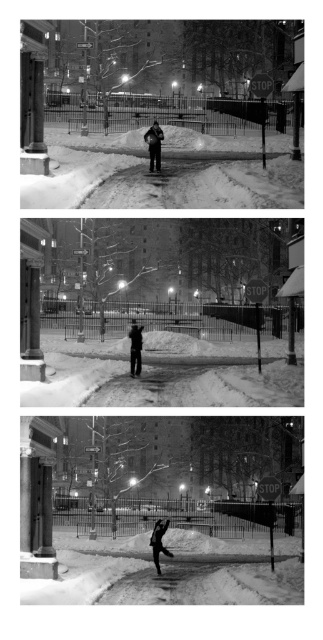
You are a photographer trying to capture both the dark gray jacket at center and the black matte snowboarder at center in the same frame. Which object should you focus on first to ensure both are in focus?

The dark gray jacket at center has a lesser height compared to black matte snowboarder at center, so you should focus on the black matte snowboarder at center first to ensure both are in focus.

In the top photograph of the snowy urban scene, there is a black matte snowboarder at center and a dark gray fabric jacket at center. Which object appears bigger in the image?

The black matte snowboarder at center appears bigger than the dark gray fabric jacket at center in the image.

You are a photographer trying to capture the scene in the top photograph of the triptych. You want to focus on the dark gray jacket at center. Where exactly should you point your camera to ensure the jacket is centered in your shot?

You should point your camera at the coordinates point (154, 145) to center the dark gray jacket at center in your shot.